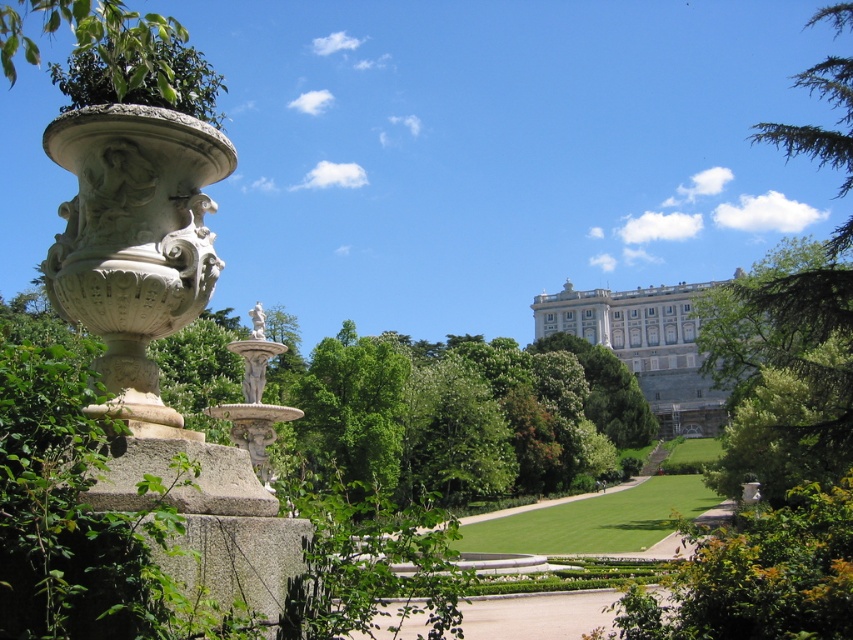
You are standing at the entrance of the garden and want to take a photo of the white marble statue at center and the green leafy tree at upper right. Which object should you position to your left to include both in the frame?

You should position the white marble statue at center to your left because the green leafy tree at upper right is to the right of it.

Based on the photo, you are a landscape architect designing a new garden. You want to place a new bench between the green leafy tree at upper right and the white marble statue at center. Which object should the bench be closer to if you want it to be proportionally balanced with their sizes?

The bench should be closer to the white marble statue at center because the green leafy tree at upper right is bigger than the white marble statue at center, so balancing their sizes would require placing the bench nearer to the smaller object to maintain visual equilibrium.

You are a landscape architect designing a new garden layout. You need to ensure that the green leafy tree at upper right and the white marble statue at center are visible from the main entrance. Considering their heights, which object might block the view of the other when viewed from the entrance?

The green leafy tree at upper right is taller than the white marble statue at center, so it might block the view of the statue if positioned between the entrance and the statue.